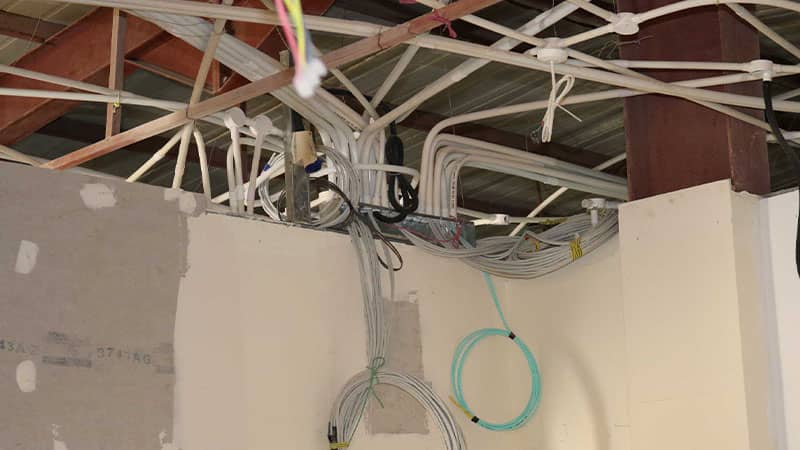
The height and width of the screenshot is (450, 800). In order to click on numbers on wall in this screenshot , I will do `click(129, 354)`.